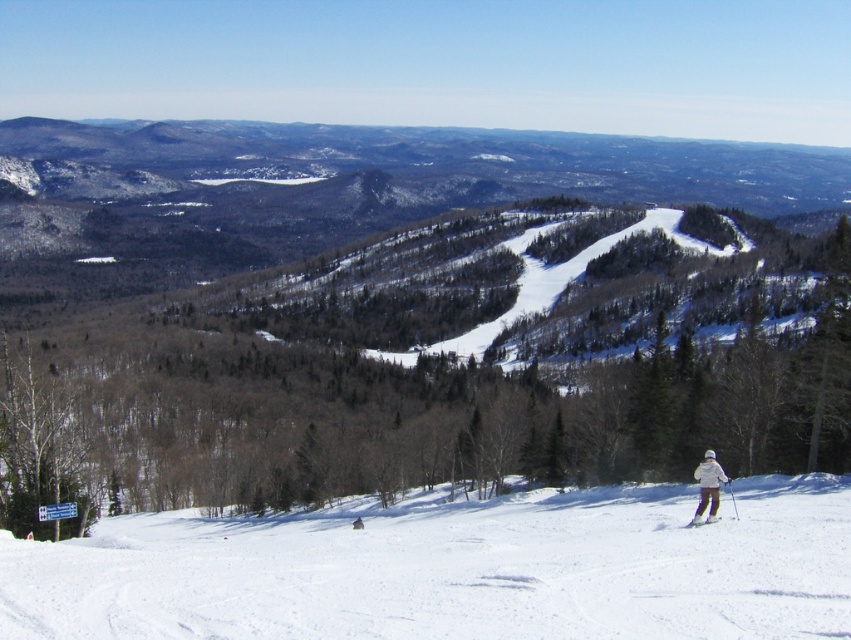
You are a skier preparing to take a photo of the white powdery snow at lower center and the white matte ski at lower right. Which object should you focus on first if you want both to be in sharp focus, considering their sizes?

The white powdery snow at lower center has a larger size compared to the white matte ski at lower right, so focusing on the larger object first would help ensure both are in sharp focus.

You are a skier preparing to make a turn on the slope. You notice the white powdery snow at lower center and the white matte ski at lower right. Which object is wider from your perspective?

The white powdery snow at lower center might be wider than white matte ski at lower right.

You are a photographer planning to take a picture of the white powdery snow at lower center and the white matte jacket at lower right. Which object will appear larger in the photo?

The white powdery snow at lower center will appear larger in the photo because it is bigger than the white matte jacket at lower lower right.